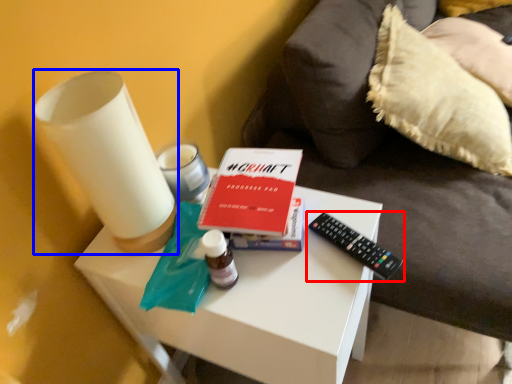
Question: Which object appears farthest to the camera in this image, remote control (highlighted by a red box) or candle holder (highlighted by a blue box)?

Choices:
 (A) remote control
 (B) candle holder

Answer: (A)